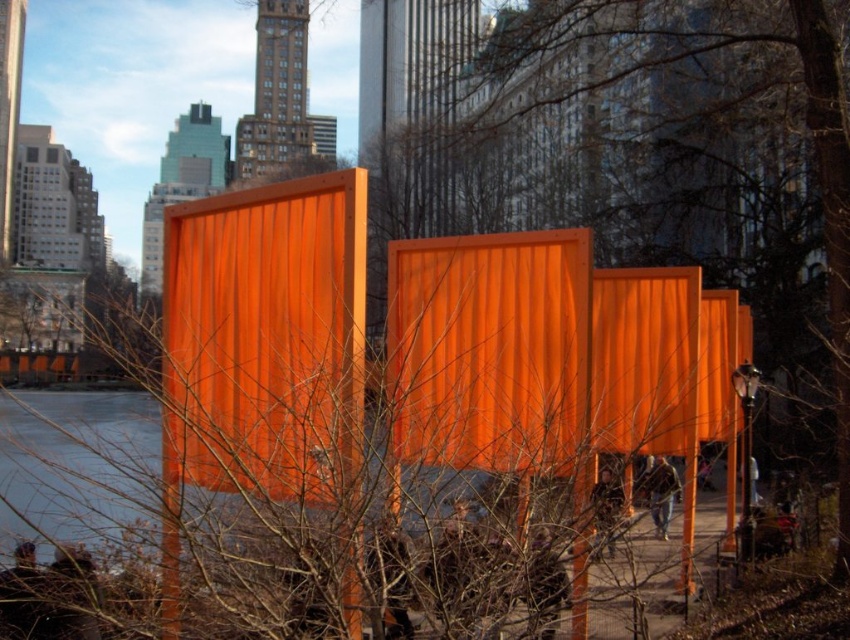
You are a delivery person trying to place a large package on top of the orange corrugated metal shipping container at center. Can you safely place it there considering the orange corrugated metal at center is positioned above it?

The orange corrugated metal at center is above the orange corrugated metal shipping container at center, so placing a large package on top of the shipping container might not be safe as there is already an object above it.

You are standing at the point marked as point [499,385] in the image. What object are you standing on?

You are standing on the orange corrugated metal at center.

You are an artist planning to place a new sculpture between the orange corrugated metal at center and the orange corrugated metal shipping container at center. According to the scene, which object should the sculpture be placed to the left of?

The orange corrugated metal at center is positioned on the right side of the orange corrugated metal shipping container at center. Therefore, the sculpture should be placed to the left of the orange corrugated metal shipping container at center.